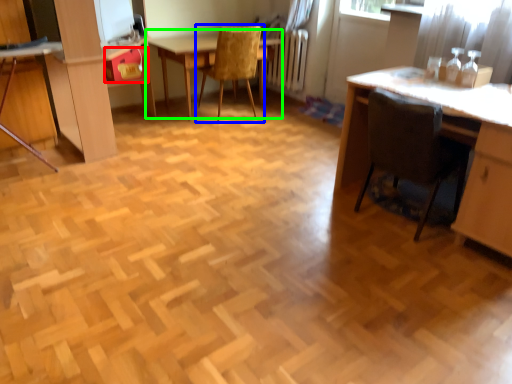
Question: Which is nearer to the drawer (highlighted by a red box)? chair (highlighted by a blue box) or table (highlighted by a green box).

Choices:
 (A) chair
 (B) table

Answer: (B)